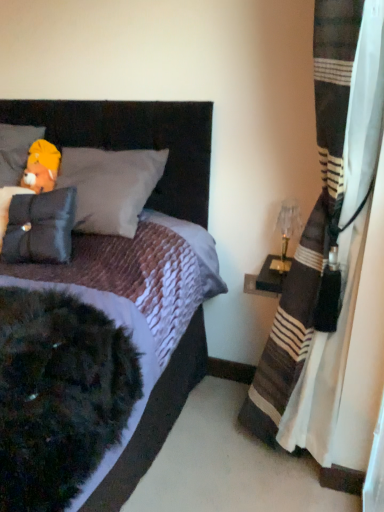
The height and width of the screenshot is (512, 384). What do you see at coordinates (287, 233) in the screenshot?
I see `translucent glass table lamp at right` at bounding box center [287, 233].

Find the location of `velvet dark brown bed at center`. velvet dark brown bed at center is located at coordinates (136, 141).

Find the location of `striped fabric curtain at right`. striped fabric curtain at right is located at coordinates (323, 237).

Is soft yellow plush at upper left, the 2th pillow when ordered from bottom to top, taller than matte black headboard at upper left?

No.

Does soft yellow plush at upper left, the first pillow viewed from the top, have a larger size compared to matte black headboard at upper left?

No.

From a real-world perspective, does soft yellow plush at upper left, the first pillow viewed from the top, sit lower than matte black headboard at upper left?

Actually, soft yellow plush at upper left, the first pillow viewed from the top, is physically above matte black headboard at upper left in the real world.

This screenshot has height=512, width=384. I want to click on toy above the matte black headboard at upper left (from a real-world perspective), so click(41, 167).

Considering the relative sizes of matte black headboard at upper left and fluffy yellow bear at upper left in the image provided, is matte black headboard at upper left bigger than fluffy yellow bear at upper left?

Yes, matte black headboard at upper left is bigger than fluffy yellow bear at upper left.

Is matte black headboard at upper left oriented away from fluffy yellow bear at upper left?

No, matte black headboard at upper left is not facing away from fluffy yellow bear at upper left.

Considering the sizes of objects matte black headboard at upper left and fluffy yellow bear at upper left in the image provided, who is shorter, matte black headboard at upper left or fluffy yellow bear at upper left?

fluffy yellow bear at upper left.

In terms of size, does matte black headboard at upper left appear bigger or smaller than striped fabric curtain at right?

In the image, matte black headboard at upper left appears to be smaller than striped fabric curtain at right.

Is matte black headboard at upper left at the right side of striped fabric curtain at right?

In fact, matte black headboard at upper left is to the left of striped fabric curtain at right.

Would you say matte black headboard at upper left is inside or outside striped fabric curtain at right?

matte black headboard at upper left is spatially situated outside striped fabric curtain at right.

Can you confirm if matte black headboard at upper left is smaller than velvet dark brown bed at center?

Yes.

Looking at this image, considering the sizes of objects matte black headboard at upper left and velvet dark brown bed at center in the image provided, who is wider, matte black headboard at upper left or velvet dark brown bed at center?

velvet dark brown bed at center.

Is point (182, 108) positioned behind point (7, 103)?

No, (182, 108) is in front of (7, 103).

From a real-world perspective, who is located lower, soft yellow plush at upper left, the first pillow viewed from the top, or fluffy yellow bear at upper left?

fluffy yellow bear at upper left.

What's the angular difference between soft yellow plush at upper left, the first pillow viewed from the top, and fluffy yellow bear at upper left's facing directions?

There is a 4.16-degree angle between the facing directions of soft yellow plush at upper left, the first pillow viewed from the top, and fluffy yellow bear at upper left.

Considering their positions, is soft yellow plush at upper left, the first pillow viewed from the top, located in front of or behind fluffy yellow bear at upper left?

Clearly, soft yellow plush at upper left, the first pillow viewed from the top, is in front of fluffy yellow bear at upper left.

Can you tell me how much striped fabric curtain at right and velvet dark brown bed at center differ in facing direction?

There is a 83.8-degree angle between the facing directions of striped fabric curtain at right and velvet dark brown bed at center.

Is striped fabric curtain at right wider or thinner than velvet dark brown bed at center?

In the image, striped fabric curtain at right appears to be more narrow than velvet dark brown bed at center.

Which point is more forward, (309, 224) or (187, 358)?

The point (309, 224) is closer.

Consider the image. From a real-world perspective, is striped fabric curtain at right below velvet dark brown bed at center?

No, from a real-world perspective, striped fabric curtain at right is not below velvet dark brown bed at center.

Which of these two, matte black headboard at upper left or matte black pillow at left, the 1th pillow ordered from the bottom, stands taller?

matte black headboard at upper left is taller.

What's the angular difference between matte black headboard at upper left and matte black pillow at left, the 1th pillow ordered from the bottom,'s facing directions?

The angle between the facing direction of matte black headboard at upper left and the facing direction of matte black pillow at left, the 1th pillow ordered from the bottom, is 8.87 degrees.

From the image's perspective, is matte black headboard at upper left on matte black pillow at left, arranged as the 2th pillow when viewed from the top?

Yes, from the image's perspective, matte black headboard at upper left is on top of matte black pillow at left, arranged as the 2th pillow when viewed from the top.

Which object is positioned more to the right, matte black headboard at upper left or matte black pillow at left, arranged as the 2th pillow when viewed from the top?

From the viewer's perspective, matte black headboard at upper left appears more on the right side.

I want to click on pillow located above the matte black headboard at upper left (from a real-world perspective), so click(x=16, y=151).

Where is `toy on the left of the matte black headboard at upper left`? This screenshot has width=384, height=512. toy on the left of the matte black headboard at upper left is located at coordinates (41, 167).

Based on their spatial positions, is fluffy yellow bear at upper left or translucent glass table lamp at right closer to matte black headboard at upper left?

fluffy yellow bear at upper left is positioned closer to the anchor matte black headboard at upper left.

Consider the image. Which object lies further to the anchor point translucent glass table lamp at right, fluffy yellow bear at upper left or striped fabric curtain at right?

The object further to translucent glass table lamp at right is fluffy yellow bear at upper left.

Looking at the image, which one is located further to soft yellow plush at upper left, the first pillow viewed from the top, velvet dark brown bed at center or matte black headboard at upper left?

Based on the image, matte black headboard at upper left appears to be further to soft yellow plush at upper left, the first pillow viewed from the top.

Estimate the real-world distances between objects in this image. Which object is further from velvet dark brown bed at center, translucent glass table lamp at right or matte black pillow at left, arranged as the 2th pillow when viewed from the top?

The object further to velvet dark brown bed at center is translucent glass table lamp at right.

Considering their positions, is translucent glass table lamp at right positioned closer to velvet dark brown bed at center than matte black headboard at upper left?

matte black headboard at upper left.

Looking at this image, when comparing their distances from soft yellow plush at upper left, the 2th pillow when ordered from bottom to top, does fluffy yellow bear at upper left or velvet dark brown bed at center seem further?

velvet dark brown bed at center lies further to soft yellow plush at upper left, the 2th pillow when ordered from bottom to top, than the other object.

Considering their positions, is fluffy yellow bear at upper left positioned further to translucent glass table lamp at right than matte black headboard at upper left?

fluffy yellow bear at upper left is further to translucent glass table lamp at right.

Looking at this image, estimate the real-world distances between objects in this image. Which object is further from striped fabric curtain at right, velvet dark brown bed at center or fluffy yellow bear at upper left?

fluffy yellow bear at upper left.

Where is `curtain between velvet dark brown bed at center and matte black headboard at upper left in the front-back direction`? curtain between velvet dark brown bed at center and matte black headboard at upper left in the front-back direction is located at coordinates (323, 237).

Find the location of a particular element. pillow located between fluffy yellow bear at upper left and striped fabric curtain at right in the left-right direction is located at coordinates (40, 227).

Locate an element on the screen. This screenshot has height=512, width=384. curtain situated between matte black headboard at upper left and translucent glass table lamp at right from left to right is located at coordinates (323, 237).

Locate an element on the screen. The width and height of the screenshot is (384, 512). pillow between velvet dark brown bed at center and soft yellow plush at upper left, the 2th pillow when ordered from bottom to top, in the front-back direction is located at coordinates (40, 227).